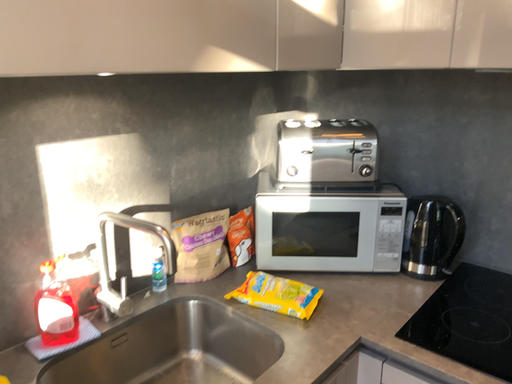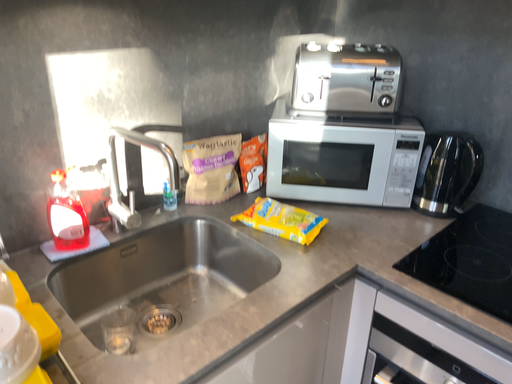
Question: Which way did the camera rotate in the video?

Choices:
 (A) rotated upward
 (B) rotated downward

Answer: (B)